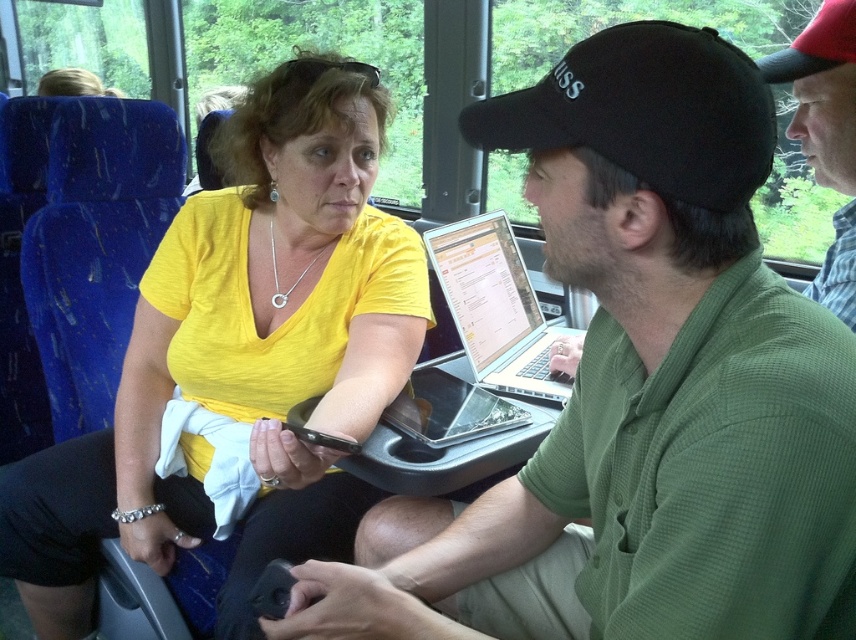
You are a delivery robot that needs to place a 20 inch long package between the green plaid shirt at upper right and the glossy silver laptop at center. Can you fit it without moving either object?

The distance between the green plaid shirt at upper right and the glossy silver laptop at center is 21.91 inches. Since the package is 20 inches long, it can fit between them as there is enough space.